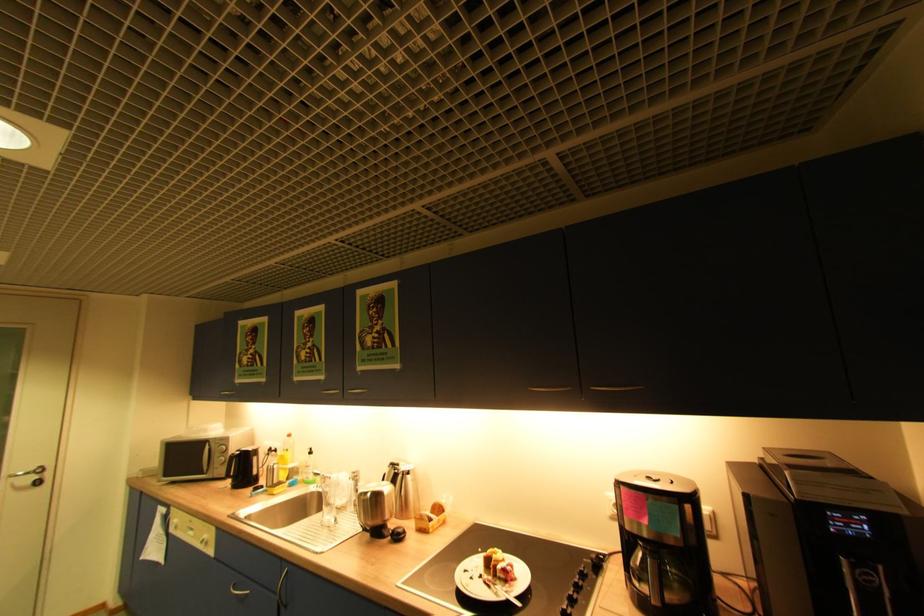
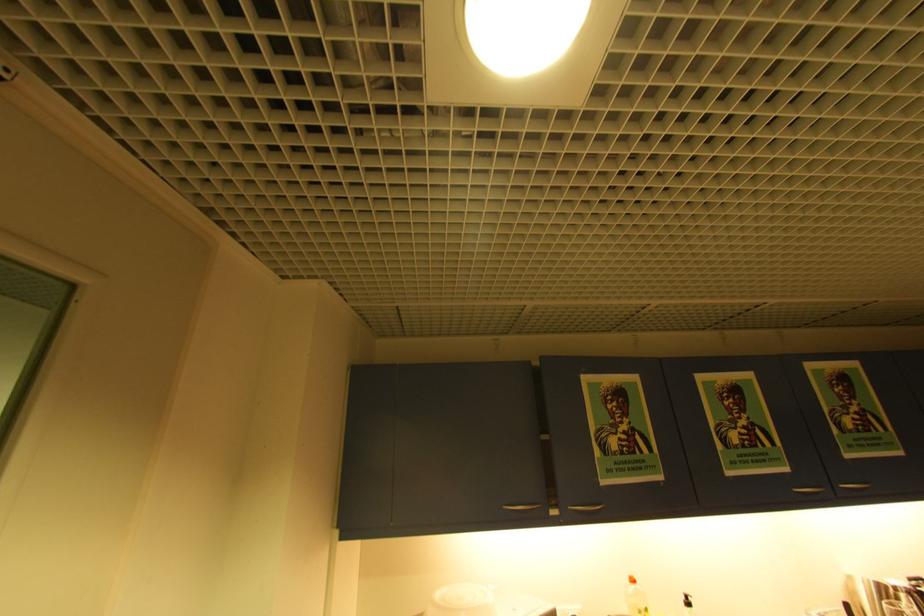
Where in the second image is the point corresponding to the point at 317,454 from the first image?

(695, 605)